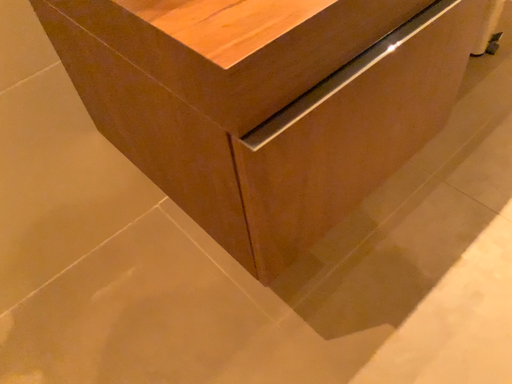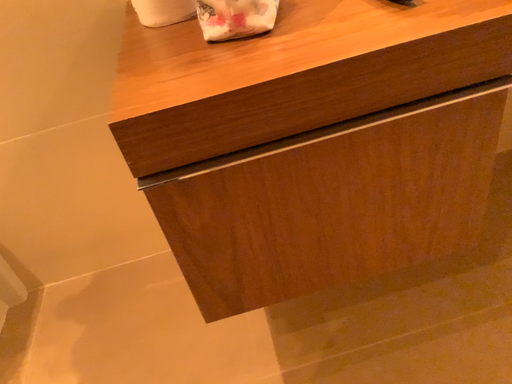
Question: How did the camera likely rotate when shooting the video?

Choices:
 (A) rotated downward
 (B) rotated upward

Answer: (B)